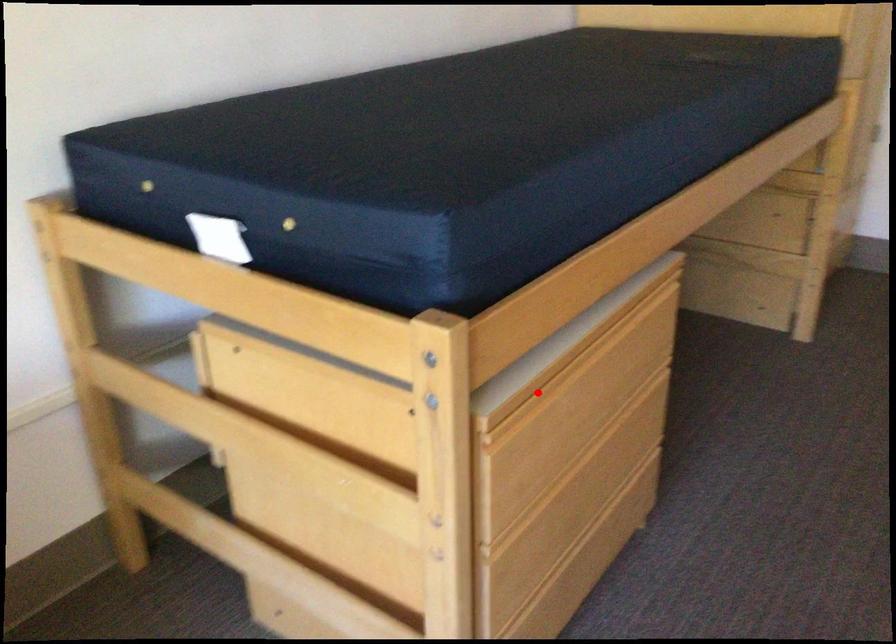
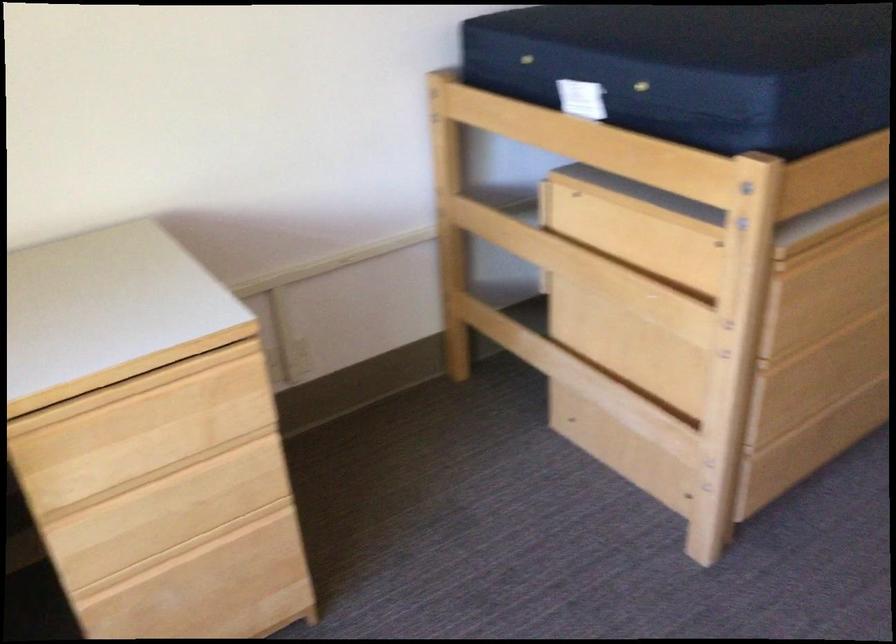
Question: I am providing you with two images of the same scene from different viewpoints. In image1, a red point is highlighted. Considering the same 3D point in image2, which of the following is correct?

Choices:
 (A) It is closer
 (B) It is farther

Answer: (B)